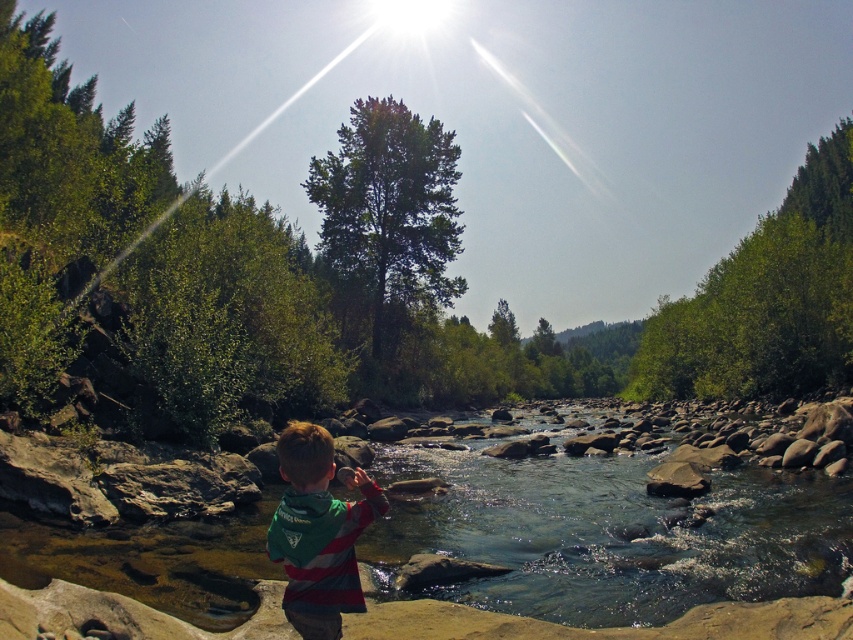
Question: Can you confirm if clear water at center is positioned below striped jersey boy at center?

Choices:
 (A) no
 (B) yes

Answer: (B)

Question: Does clear water at center have a greater width compared to striped jersey boy at center?

Choices:
 (A) no
 (B) yes

Answer: (B)

Question: Can you confirm if clear water at center is thinner than striped jersey boy at center?

Choices:
 (A) no
 (B) yes

Answer: (A)

Question: Which point is farther to the camera?

Choices:
 (A) clear water at center
 (B) striped jersey boy at center

Answer: (A)